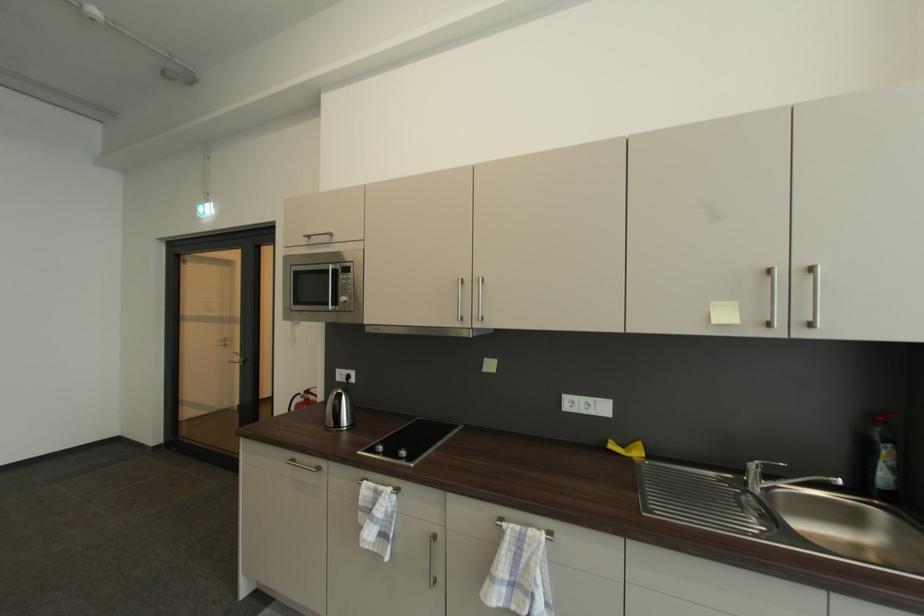
The image size is (924, 616). What do you see at coordinates (882, 456) in the screenshot? I see `the spray bottle trigger` at bounding box center [882, 456].